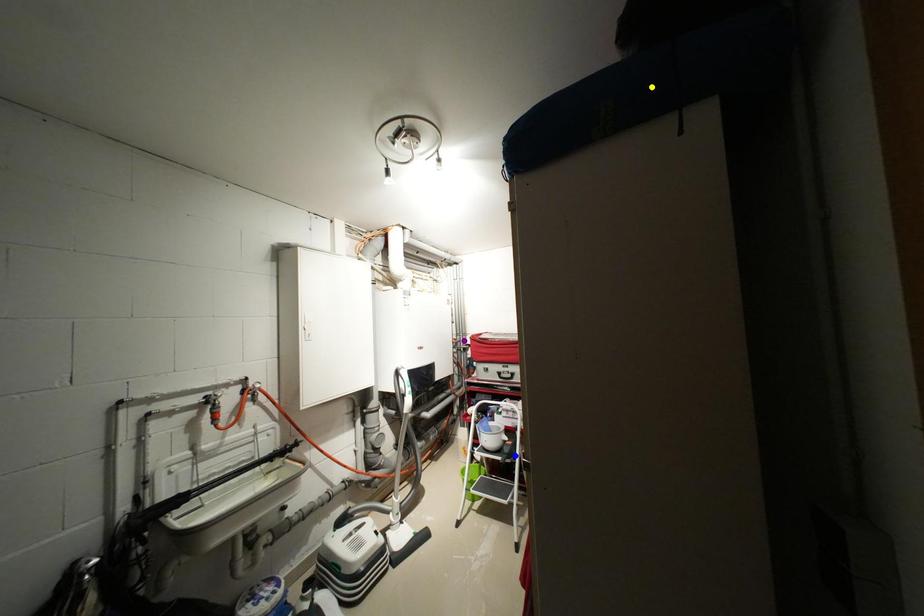
Order these from nearest to farthest:
blue point | yellow point | purple point

yellow point, blue point, purple point